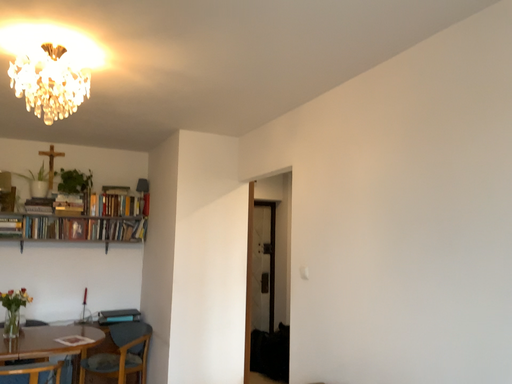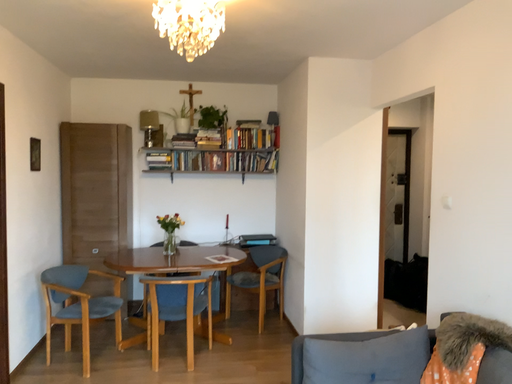
Question: How did the camera likely rotate when shooting the video?

Choices:
 (A) rotated left
 (B) rotated right

Answer: (A)